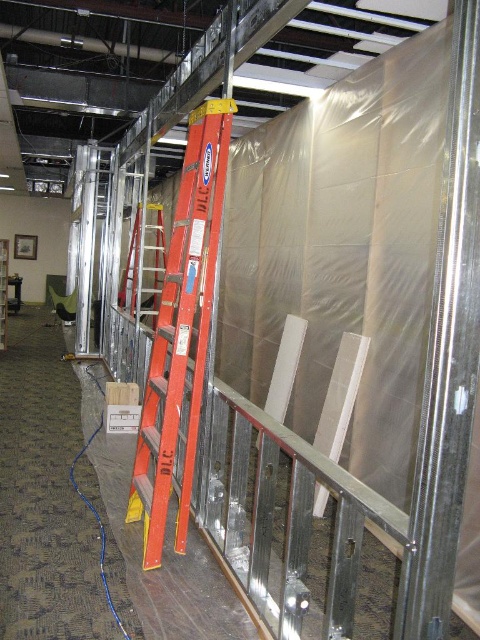
Question: Does orange aluminum ladder at center lie behind orange fiberglass ladder at center?

Choices:
 (A) no
 (B) yes

Answer: (A)

Question: Which point appears closest to the camera in this image?

Choices:
 (A) [x=136, y=486]
 (B) [x=132, y=273]

Answer: (A)

Question: Which point is farther to the camera?

Choices:
 (A) orange aluminum ladder at center
 (B) orange fiberglass ladder at center

Answer: (B)

Question: Is orange aluminum ladder at center to the right of orange fiberglass ladder at center from the viewer's perspective?

Choices:
 (A) no
 (B) yes

Answer: (B)

Question: Is orange aluminum ladder at center to the left of orange fiberglass ladder at center from the viewer's perspective?

Choices:
 (A) no
 (B) yes

Answer: (A)